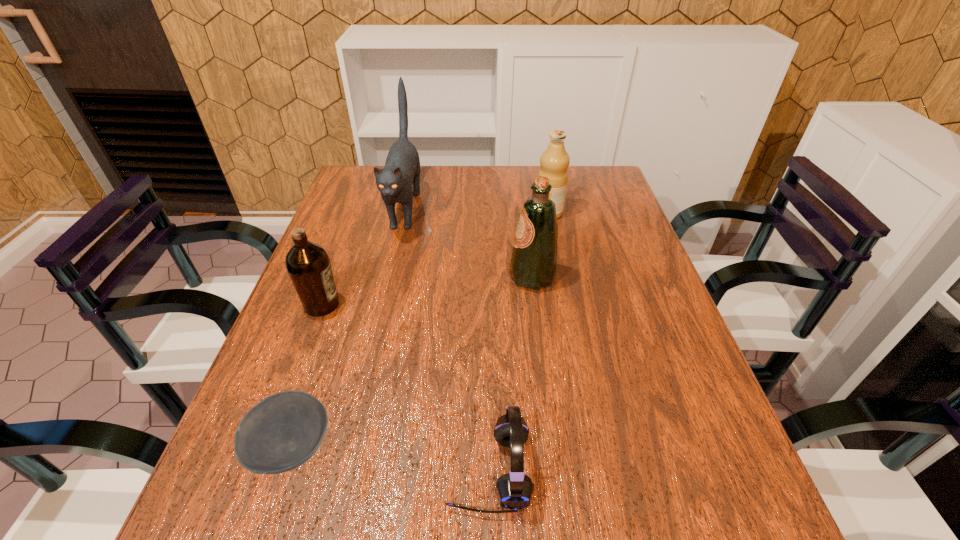
Select which olive oil is the third closest to the bowl. Please provide its 2D coordinates. Your answer should be formatted as a tuple, i.e. [(x, y)], where the tuple contains the x and y coordinates of a point satisfying the conditions above.

[(554, 161)]

Locate an element on the screen. olive oil that is the second closest one to the fourth tallest object is located at coordinates click(x=554, y=161).

You are a GUI agent. You are given a task and a screenshot of the screen. Output one action in this format:
    pyautogui.click(x=<x>, y=<y>)
    Task: Click on the vacant space that satisfies the following two spatial constraints: 1. on the label of the leftmost olive oil; 2. on the left side of the shortest object
    
    Given the screenshot: What is the action you would take?
    pyautogui.click(x=269, y=447)

Identify the location of blank space that satisfies the following two spatial constraints: 1. at the face of the cat; 2. on the label of the third shortest object. (383, 305).